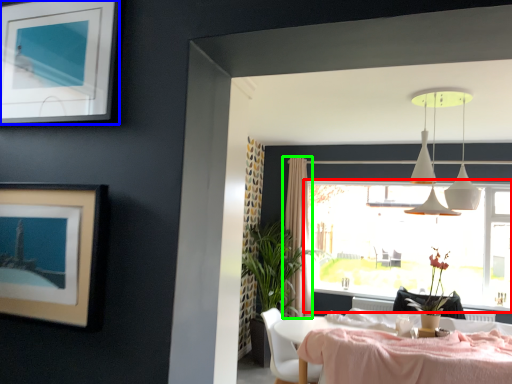
Question: Which is farther away from window (highlighted by a red box)? picture frame (highlighted by a blue box) or curtain (highlighted by a green box)?

Choices:
 (A) picture frame
 (B) curtain

Answer: (A)